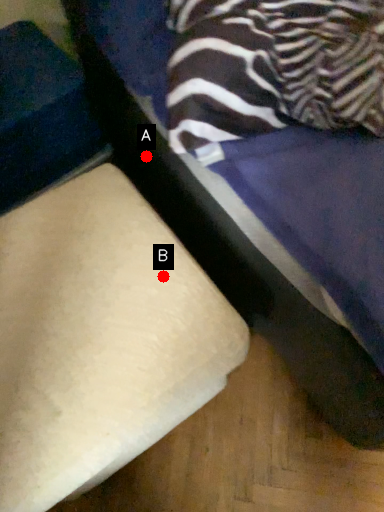
Question: Two points are circled on the image, labeled by A and B beside each circle. Which point is farther to the camera?

Choices:
 (A) A is further
 (B) B is further

Answer: (A)